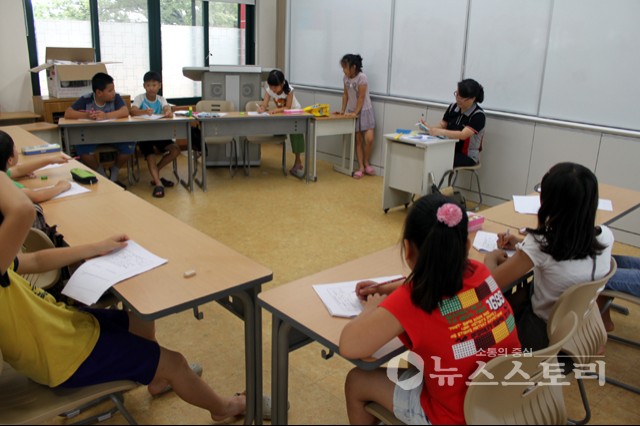
The width and height of the screenshot is (640, 426). Identify the location of wall. (26, 67).